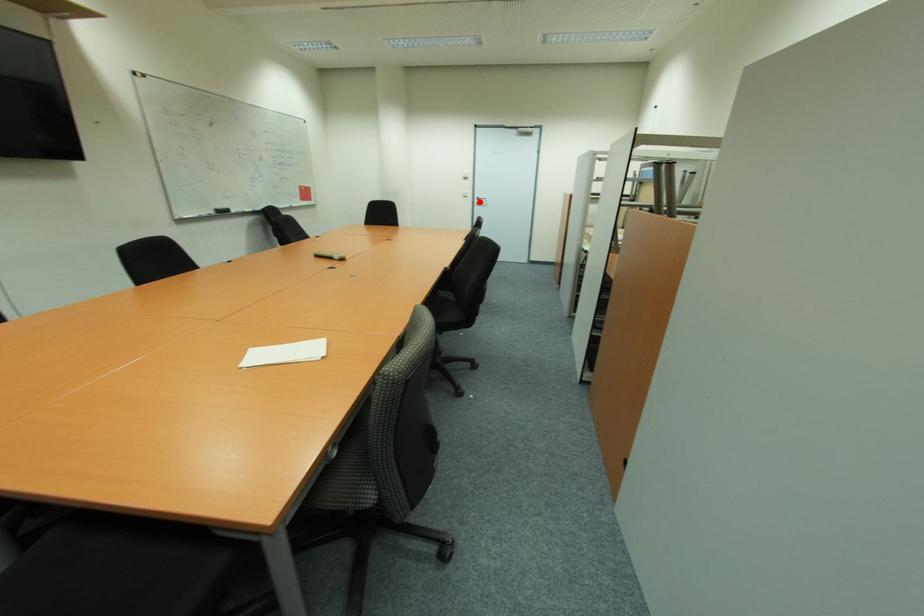
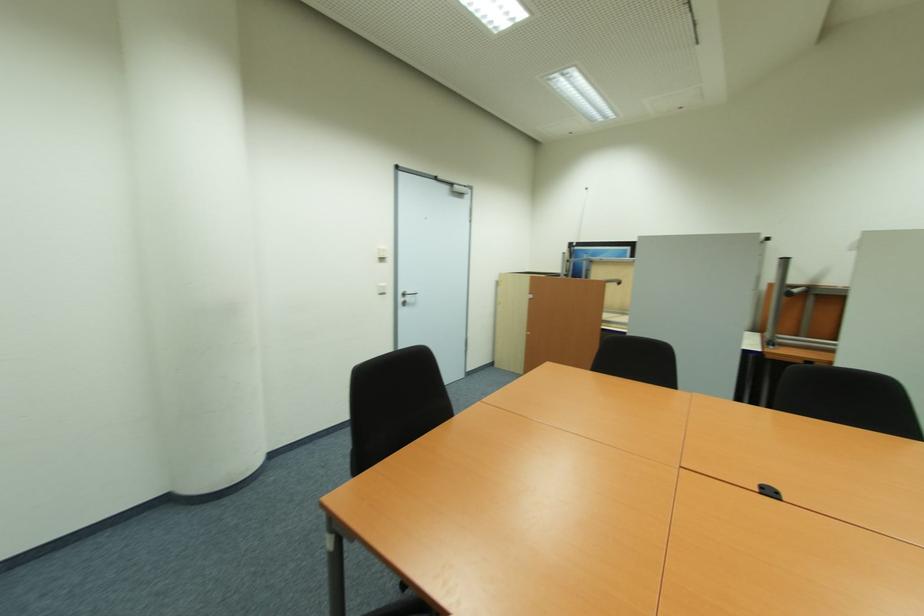
Find the pixel in the second image that matches the highlighted location in the first image.

(405, 300)